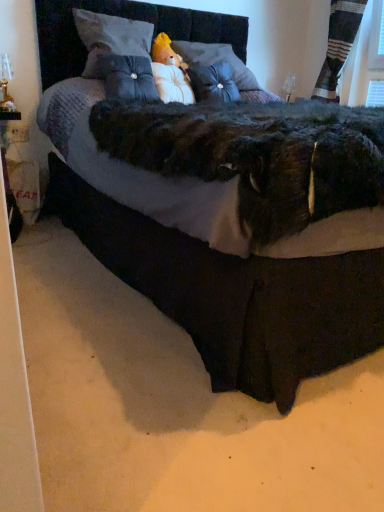
Question: Based on their positions, is white plush at center, the second pillow positioned from the right, located to the left or right of white plush doll at lower left?

Choices:
 (A) right
 (B) left

Answer: (A)

Question: Is white plush at center, the second pillow positioned from the right, bigger or smaller than white plush doll at lower left?

Choices:
 (A) small
 (B) big

Answer: (B)

Question: Estimate the real-world distances between objects in this image. Which object is farther from the suede-like blue pillow at center, the second pillow when ordered from left to right?

Choices:
 (A) white plush doll at lower left
 (B) white plush at center, the second pillow positioned from the right
 (C) velvet black bed at center
 (D) striped fabric curtain at upper right
 (E) velvet gray pillow at upper center, placed as the 4th pillow when sorted from right to left

Answer: (D)

Question: Based on their relative distances, which object is farther from the suede-like blue pillow at center, the second pillow when ordered from left to right?

Choices:
 (A) satin blue pillow at center, which is counted as the fourth pillow, starting from the left
 (B) velvet black bed at center
 (C) striped fabric curtain at upper right
 (D) white plush doll at lower left
 (E) velvet gray pillow at upper center, placed as the 4th pillow when sorted from right to left

Answer: (C)